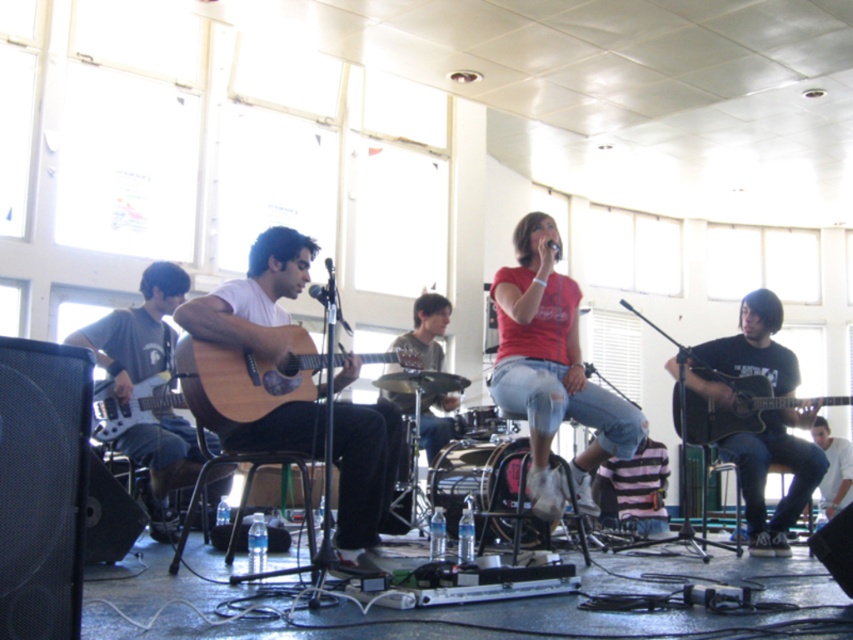
Question: Which point is farther to the camera?

Choices:
 (A) (764, 451)
 (B) (137, 369)

Answer: (A)

Question: Which of the following is the farthest from the observer?

Choices:
 (A) acoustic guitar at right
 (B) matte black acoustic guitar at right
 (C) red matte shirt at center
 (D) natural wood acoustic guitar at center

Answer: (A)

Question: Which point is closer to the camera?

Choices:
 (A) matte black bass guitar at left
 (B) matte light brown acoustic guitar at center
 (C) matte black guitar at left

Answer: (B)

Question: Is red matte shirt at center to the right of matte black bass guitar at left from the viewer's perspective?

Choices:
 (A) yes
 (B) no

Answer: (A)

Question: Is matte light brown acoustic guitar at center thinner than matte black guitar at left?

Choices:
 (A) no
 (B) yes

Answer: (A)

Question: Does acoustic guitar at right lie in front of matte black guitar at left?

Choices:
 (A) yes
 (B) no

Answer: (B)